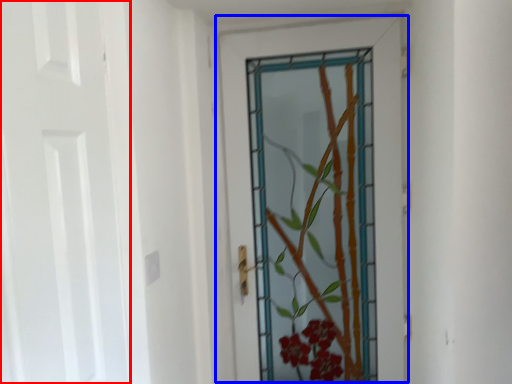
Question: Which object is closer to the camera taking this photo, door (highlighted by a red box) or door (highlighted by a blue box)?

Choices:
 (A) door
 (B) door

Answer: (A)